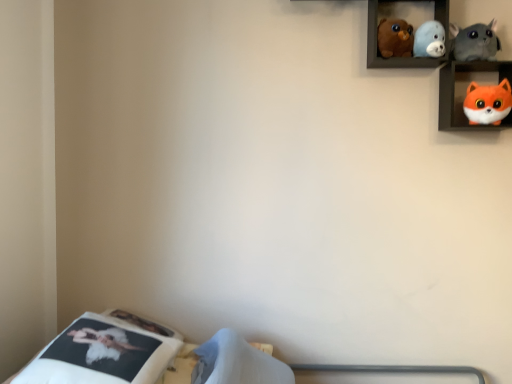
Locate an element on the screen. vacant point above orange plush toy at upper right, which is the second shelf from left to right (from a real-world perspective) is located at coordinates (473, 59).